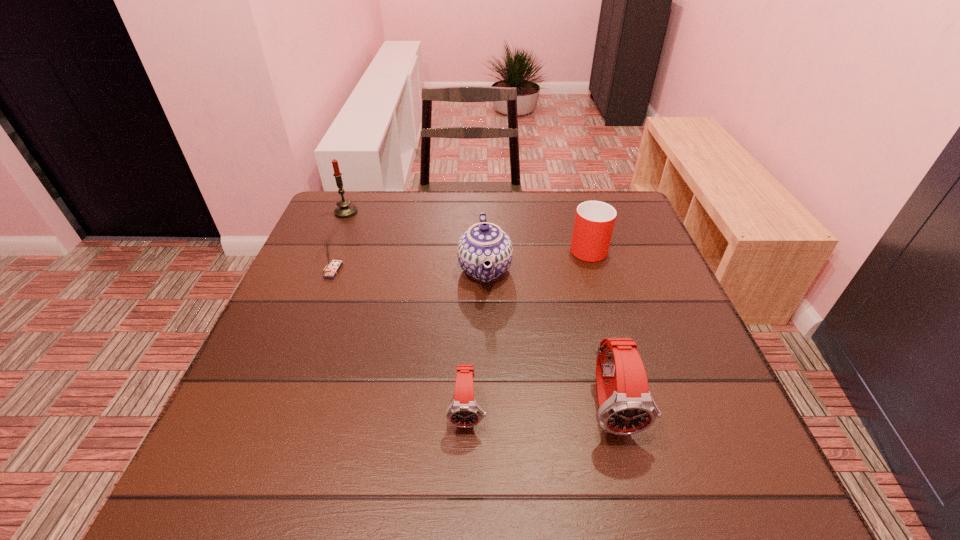
At what (x,y) coordinates should I click in order to perform the action: click on the shorter watch. Please return your answer as a coordinate pair (x, y). Looking at the image, I should click on (464, 412).

Where is `the taller watch`? Image resolution: width=960 pixels, height=540 pixels. the taller watch is located at coordinates (626, 407).

Where is `cup`? The width and height of the screenshot is (960, 540). cup is located at coordinates (594, 221).

Where is `candle`? The height and width of the screenshot is (540, 960). candle is located at coordinates (345, 209).

What are the coordinates of `chinaware` in the screenshot? It's located at (483, 243).

The height and width of the screenshot is (540, 960). I want to click on matchbox, so click(333, 267).

The width and height of the screenshot is (960, 540). I want to click on vacant space located on the side of the cup with the handle, so click(x=570, y=191).

Locate an element on the screen. Image resolution: width=960 pixels, height=540 pixels. free space located 0.120m on the side of the cup with the handle is located at coordinates (576, 208).

At what (x,y) coordinates should I click in order to perform the action: click on free space located 0.150m on the side of the cup with the handle. Please return your answer as a coordinate pair (x, y). This screenshot has width=960, height=540. Looking at the image, I should click on (574, 203).

Locate an element on the screen. The image size is (960, 540). vacant region located on the front of the candle is located at coordinates (310, 298).